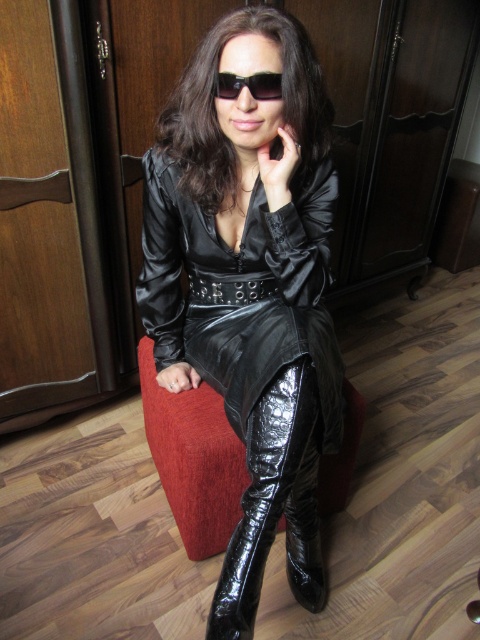
Who is lower down, glossy leather dress at center or glossy patent leather boot at lower center?

Positioned lower is glossy patent leather boot at lower center.

Looking at this image, can you confirm if glossy leather dress at center is positioned above glossy patent leather boot at lower center?

Correct, glossy leather dress at center is located above glossy patent leather boot at lower center.

Is point (265, 124) positioned before point (266, 492)?

No.

In order to click on glossy leather dress at center in this screenshot , I will do `click(250, 285)`.

Can you confirm if glossy leather dress at center is bigger than black glossy sunglasses at center?

Yes.

Which is in front, point (305, 408) or point (264, 81)?

Positioned in front is point (264, 81).

Between point (186, 104) and point (260, 83), which one is positioned behind?

The point (186, 104) is behind.

Find the location of `glossy leather dress at center`. glossy leather dress at center is located at coordinates (250, 285).

Does glossy patent leather boot at lower center have a greater width compared to black glossy sunglasses at center?

Correct, the width of glossy patent leather boot at lower center exceeds that of black glossy sunglasses at center.

Is glossy patent leather boot at lower center bigger than black glossy sunglasses at center?

Correct, glossy patent leather boot at lower center is larger in size than black glossy sunglasses at center.

Where is `glossy patent leather boot at lower center`? glossy patent leather boot at lower center is located at coordinates (264, 496).